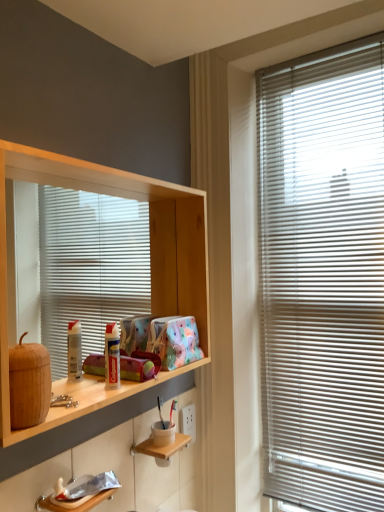
Question: From a real-world perspective, is wooden shelf at left, arranged as the first shelf when viewed from the top, below white plastic blinds at right?

Choices:
 (A) yes
 (B) no

Answer: (B)

Question: Is wooden shelf at left, arranged as the 2th shelf when ordered from the bottom, taller than white plastic blinds at right?

Choices:
 (A) yes
 (B) no

Answer: (B)

Question: Does wooden shelf at left, arranged as the first shelf when viewed from the top, have a lesser width compared to white plastic blinds at right?

Choices:
 (A) no
 (B) yes

Answer: (A)

Question: Is wooden shelf at left, arranged as the first shelf when viewed from the top, facing away from white plastic blinds at right?

Choices:
 (A) yes
 (B) no

Answer: (B)

Question: Is wooden shelf at left, arranged as the 2th shelf when ordered from the bottom, facing towards white plastic blinds at right?

Choices:
 (A) no
 (B) yes

Answer: (A)

Question: Is wooden shelf at left, arranged as the 2th shelf when ordered from the bottom, placed right next to white plastic blinds at right?

Choices:
 (A) yes
 (B) no

Answer: (B)

Question: Considering the relative sizes of white plastic blinds at right and wooden shelf at lower center, which ranks as the 2th shelf in top-to-bottom order, in the image provided, is white plastic blinds at right wider than wooden shelf at lower center, which ranks as the 2th shelf in top-to-bottom order,?

Choices:
 (A) no
 (B) yes

Answer: (A)

Question: Can you confirm if white plastic blinds at right is positioned to the right of wooden shelf at lower center, which ranks as the 2th shelf in top-to-bottom order?

Choices:
 (A) no
 (B) yes

Answer: (B)

Question: From a real-world perspective, is white plastic blinds at right physically below wooden shelf at lower center, positioned as the first shelf in bottom-to-top order?

Choices:
 (A) yes
 (B) no

Answer: (B)

Question: Does white plastic blinds at right have a larger size compared to wooden shelf at lower center, which ranks as the 2th shelf in top-to-bottom order?

Choices:
 (A) no
 (B) yes

Answer: (B)

Question: Is the position of white plastic blinds at right more distant than that of wooden shelf at lower center, which ranks as the 2th shelf in top-to-bottom order?

Choices:
 (A) no
 (B) yes

Answer: (B)

Question: Could wooden shelf at lower center, which ranks as the 2th shelf in top-to-bottom order, be considered to be inside white plastic blinds at right?

Choices:
 (A) no
 (B) yes

Answer: (A)

Question: Considering the relative positions of wooden shelf at lower center, which ranks as the 2th shelf in top-to-bottom order, and wooden shelf at left, arranged as the first shelf when viewed from the top, in the image provided, is wooden shelf at lower center, which ranks as the 2th shelf in top-to-bottom order, behind wooden shelf at left, arranged as the first shelf when viewed from the top,?

Choices:
 (A) no
 (B) yes

Answer: (B)